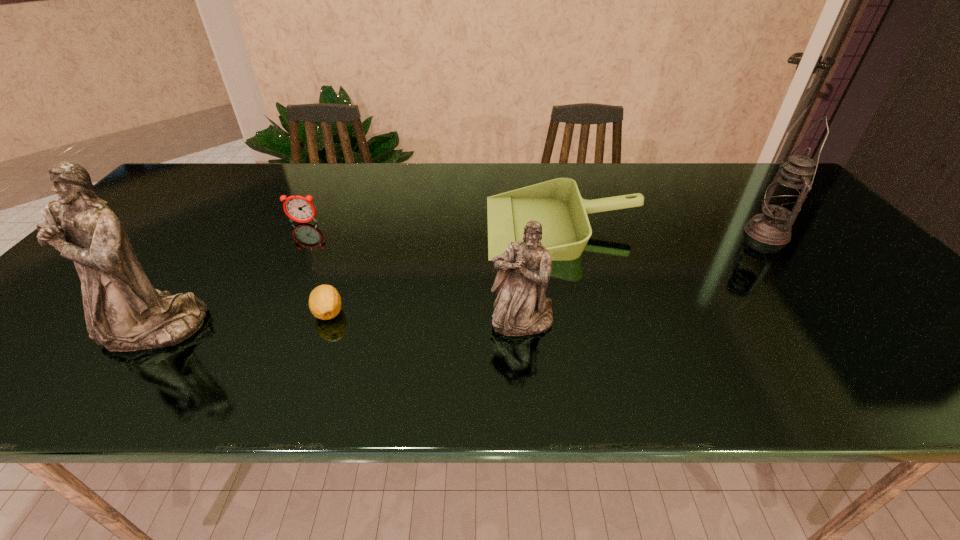
You are a GUI agent. You are given a task and a screenshot of the screen. Output one action in this format:
    pyautogui.click(x=<x>, y=<y>)
    Task: Click on the vacant space that is in between the dustpan and the second object from left to right
    
    Given the screenshot: What is the action you would take?
    pyautogui.click(x=433, y=225)

The image size is (960, 540). In order to click on vacant area between the dustpan and the oil lamp in this screenshot , I will do `click(664, 230)`.

Where is `object that stands as the third closest to the left figurine`? The image size is (960, 540). object that stands as the third closest to the left figurine is located at coordinates (521, 308).

Point out which object is positioned as the fifth nearest to the fourth object from right to left. Please provide its 2D coordinates. Your answer should be formatted as a tuple, i.e. [(x, y)], where the tuple contains the x and y coordinates of a point satisfying the conditions above.

[(784, 198)]

This screenshot has width=960, height=540. I want to click on vacant area in the image that satisfies the following two spatial constraints: 1. on the front-facing side of the fifth shortest object; 2. on the left side of the fifth object from right to left, so click(x=299, y=233).

What are the coordinates of `free location that satisfies the following two spatial constraints: 1. on the scoop of the dustpan; 2. on the front-facing side of the right figurine` in the screenshot? It's located at (586, 321).

Identify the location of vacant space that satisfies the following two spatial constraints: 1. on the scoop of the dustpan; 2. at the stem end of the fourth object from right to left. The image size is (960, 540). (x=584, y=312).

Find the location of a particular element. Image resolution: width=960 pixels, height=540 pixels. vacant region that satisfies the following two spatial constraints: 1. on the scoop of the dustpan; 2. at the stem end of the third object from left to right is located at coordinates (584, 312).

Where is `vacant space that satisfies the following two spatial constraints: 1. on the front-facing side of the second tallest object; 2. on the left side of the fifth object from right to left`? The image size is (960, 540). vacant space that satisfies the following two spatial constraints: 1. on the front-facing side of the second tallest object; 2. on the left side of the fifth object from right to left is located at coordinates (299, 233).